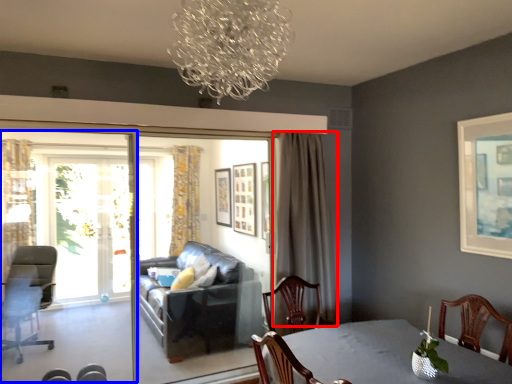
Question: Which point is further to the camera, curtain (highlighted by a red box) or screen door (highlighted by a blue box)?

Choices:
 (A) curtain
 (B) screen door

Answer: (A)